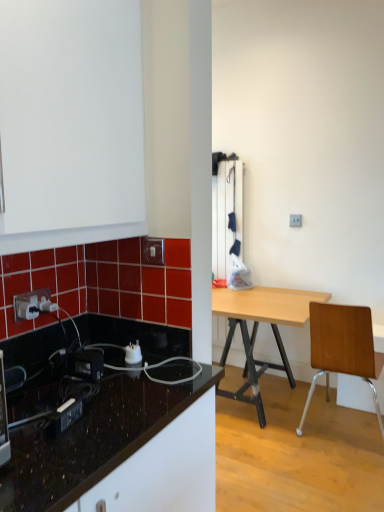
Question: Does brown wooden chair at right touch black glossy countertop at lower left?

Choices:
 (A) no
 (B) yes

Answer: (A)

Question: Considering the relative sizes of brown wooden chair at right and black glossy countertop at lower left in the image provided, is brown wooden chair at right shorter than black glossy countertop at lower left?

Choices:
 (A) no
 (B) yes

Answer: (A)

Question: Can you confirm if brown wooden chair at right is thinner than black glossy countertop at lower left?

Choices:
 (A) no
 (B) yes

Answer: (B)

Question: Is brown wooden chair at right far from black glossy countertop at lower left?

Choices:
 (A) yes
 (B) no

Answer: (A)

Question: From a real-world perspective, is brown wooden chair at right located higher than black glossy countertop at lower left?

Choices:
 (A) no
 (B) yes

Answer: (B)

Question: In the image, is black glossy countertop at lower left positioned in front of or behind brown wooden chair at right?

Choices:
 (A) behind
 (B) front

Answer: (B)

Question: Looking at the image, does black glossy countertop at lower left seem bigger or smaller compared to brown wooden chair at right?

Choices:
 (A) small
 (B) big

Answer: (B)

Question: From a real-world perspective, is black glossy countertop at lower left above or below brown wooden chair at right?

Choices:
 (A) below
 (B) above

Answer: (A)

Question: Is point (59, 498) positioned closer to the camera than point (327, 311)?

Choices:
 (A) farther
 (B) closer

Answer: (B)

Question: Based on their sizes in the image, would you say white glossy power outlet at upper left is bigger or smaller than white glossy electric outlet at upper center?

Choices:
 (A) small
 (B) big

Answer: (B)

Question: Looking at their shapes, would you say white glossy power outlet at upper left is wider or thinner than white glossy electric outlet at upper center?

Choices:
 (A) thin
 (B) wide

Answer: (A)

Question: From the image's perspective, is white glossy power outlet at upper left located above or below white glossy electric outlet at upper center?

Choices:
 (A) above
 (B) below

Answer: (B)

Question: From a real-world perspective, relative to white glossy electric outlet at upper center, is white glossy power outlet at upper left vertically above or below?

Choices:
 (A) below
 (B) above

Answer: (A)

Question: From the image's perspective, is white glossy power outlet at upper left located above or below white plastic power plugs and sockets at lower left?

Choices:
 (A) below
 (B) above

Answer: (B)

Question: In the image, is white glossy power outlet at upper left on the left side or the right side of white plastic power plugs and sockets at lower left?

Choices:
 (A) left
 (B) right

Answer: (A)